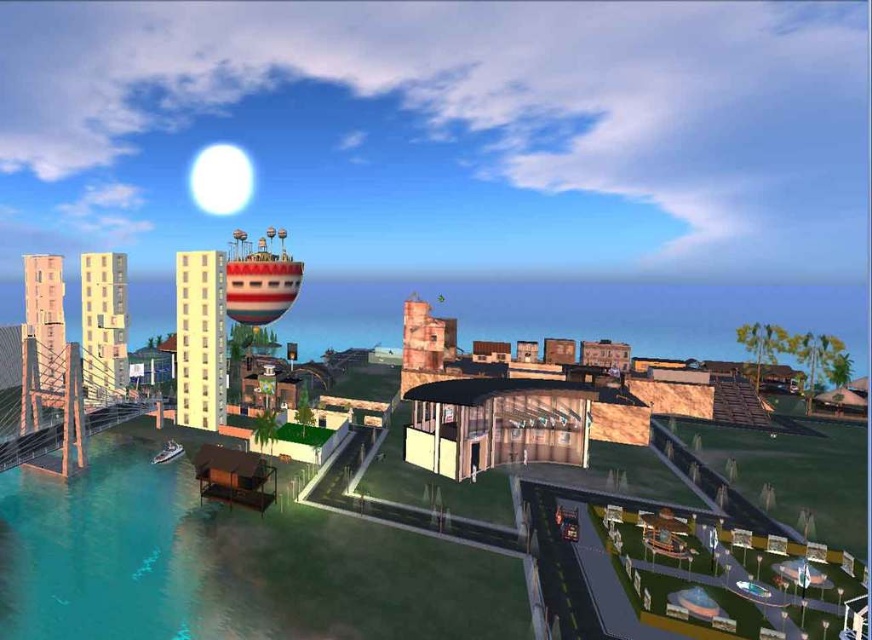
Question: Based on their relative distances, which object is farther from the metallic silver boat at lower left?

Choices:
 (A) clear blue water at lower left
 (B) striped fabric water tower at upper center

Answer: (B)

Question: Which point appears farthest from the camera in this image?

Choices:
 (A) 366,637
 (B) 261,246
 (C) 168,452

Answer: (B)

Question: From the image, what is the correct spatial relationship of clear blue water at lower left in relation to metallic silver boat at lower left?

Choices:
 (A) above
 (B) below

Answer: (B)

Question: Is clear blue water at lower left further to the viewer compared to metallic silver boat at lower left?

Choices:
 (A) yes
 (B) no

Answer: (B)

Question: Estimate the real-world distances between objects in this image. Which object is farther from the metallic silver boat at lower left?

Choices:
 (A) clear blue water at lower left
 (B) striped fabric water tower at upper center

Answer: (B)

Question: Where is clear blue water at lower left located in relation to striped fabric water tower at upper center in the image?

Choices:
 (A) above
 (B) below

Answer: (B)